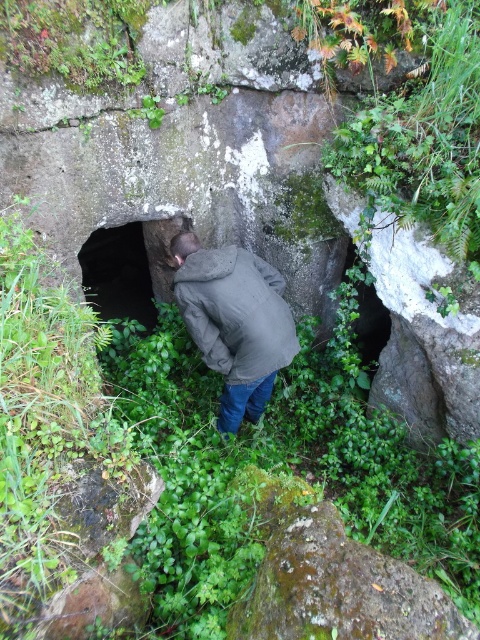
You are a hiker who wants to enter the dark stone cave at center. You notice the dark gray cotton jacket at center lying on the ground. Is the jacket blocking your path to the cave entrance?

The dark gray cotton jacket at center is below the dark stone cave at center, so it is positioned lower and likely blocking the path to the cave entrance.

You are a hiker who wants to enter the dark stone cave at center. You are currently standing near the dark gray cotton jacket at center. Which direction should you move to reach the cave?

Since the dark gray cotton jacket at center is closer to the viewer than the dark stone cave at center, you should move backward to reach the cave.